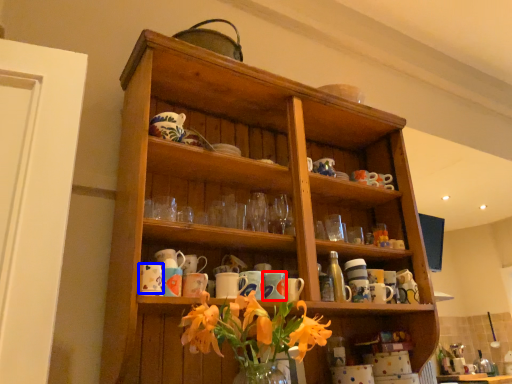
Question: Which object is further to the camera taking this photo, mug (highlighted by a red box) or mug (highlighted by a blue box)?

Choices:
 (A) mug
 (B) mug

Answer: (A)